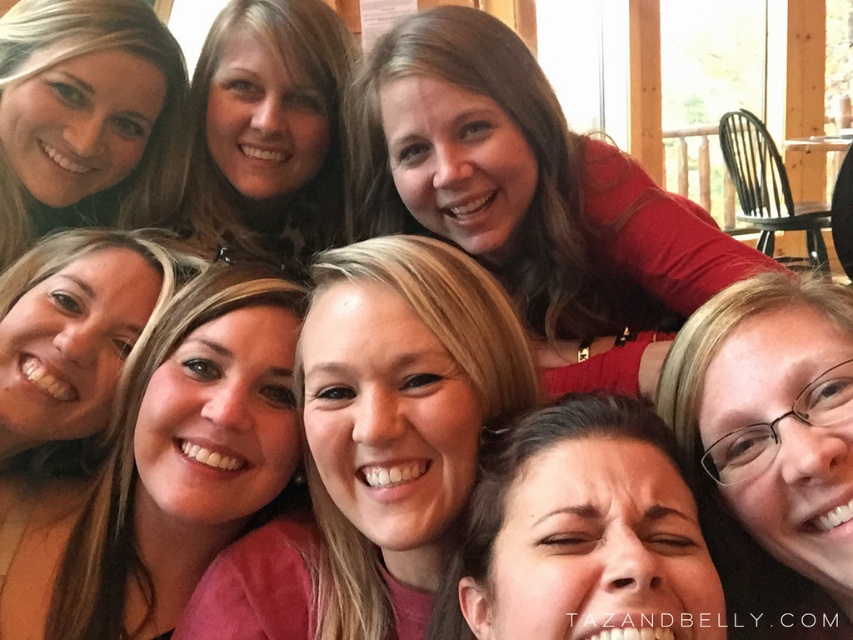
You are a photographer trying to adjust the lighting for a group photo. You notice two shirts in the scene, the matte red shirt at upper center and the pink matte shirt at center. Which shirt is closer to the light source coming from the windows behind them?

The matte red shirt at upper center is closer to the light source because it is 19.21 inches away from the pink matte shirt at center, implying it is nearer to the windows.